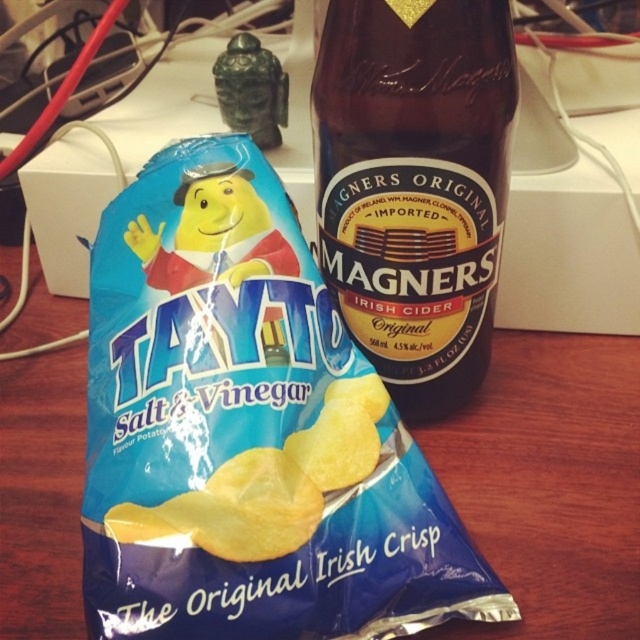
Is brown glass bottle at center wider than blue matte chips at center?

Incorrect, brown glass bottle at center's width does not surpass blue matte chips at center's.

Who is positioned more to the left, brown glass bottle at center or blue matte chips at center?

blue matte chips at center

The height and width of the screenshot is (640, 640). What are the coordinates of `brown glass bottle at center` in the screenshot? It's located at (413, 186).

Between blue matte plastic bag of chips at center and brown glass bottle at center, which one has less height?

brown glass bottle at center is shorter.

From the picture: Does blue matte plastic bag of chips at center come behind brown glass bottle at center?

No, blue matte plastic bag of chips at center is closer to the viewer.

Locate an element on the screen. This screenshot has width=640, height=640. blue matte plastic bag of chips at center is located at coordinates (248, 432).

Can you confirm if blue matte plastic bag of chips at center is positioned below blue matte chips at center?

Actually, blue matte plastic bag of chips at center is above blue matte chips at center.

Does blue matte plastic bag of chips at center have a smaller size compared to blue matte chips at center?

Actually, blue matte plastic bag of chips at center might be larger than blue matte chips at center.

What do you see at coordinates (248, 432) in the screenshot?
I see `blue matte plastic bag of chips at center` at bounding box center [248, 432].

The image size is (640, 640). I want to click on blue matte plastic bag of chips at center, so click(x=248, y=432).